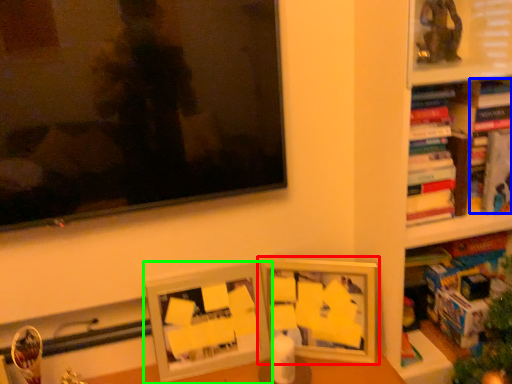
Question: Considering the real-world distances, which object is farthest from picture frame (highlighted by a red box)? book (highlighted by a blue box) or picture frame (highlighted by a green box)?

Choices:
 (A) book
 (B) picture frame

Answer: (A)